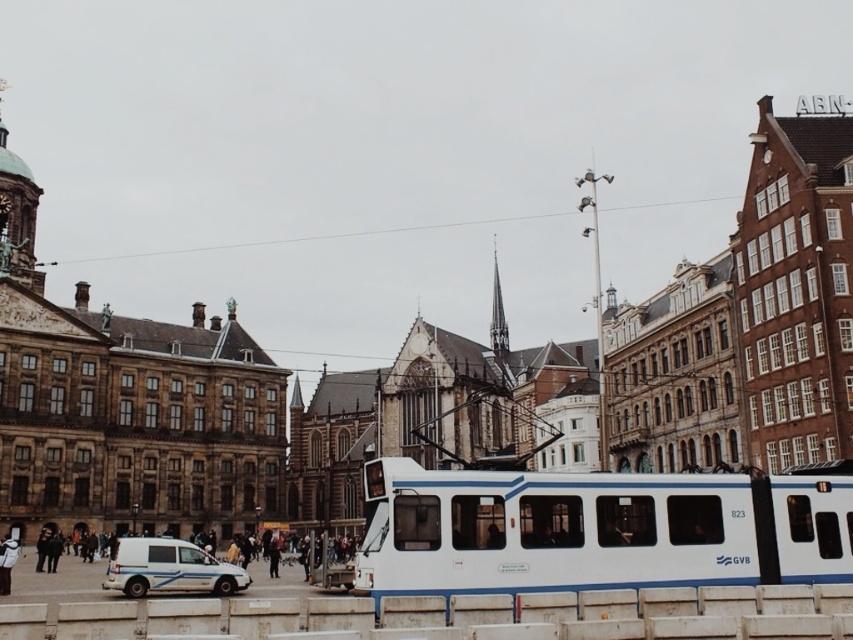
You are a city planner analyzing traffic flow. The white glossy passenger train at center and the white matte van at lower left are both in the scene. Which one has a larger size?

The white glossy passenger train at center is bigger than the white matte van at lower left.